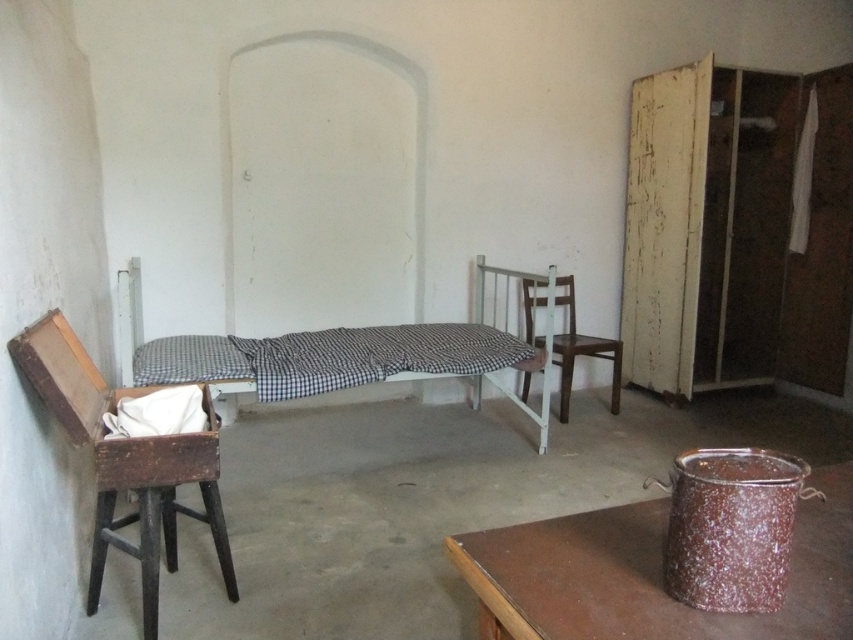
You are a guest staying in this room and want to place your new pillow, which is 15 cm taller than the existing one, on the bed. Can the checkered fabric bed at center support the height of your new pillow compared to the white cotton pillow at center?

The checkered fabric bed at center is taller than the white cotton pillow at center. Since your new pillow is 15 cm taller than the existing one, it should fit as the bed is already taller than the current pillow.

You are standing in the center of the room and want to move to the wooden chair at left. Which direction should you face to walk towards it?

You should face towards the left direction to walk towards the wooden chair at left.

You are a guest in this room and want to place a new decorative pillow on the bed. The existing white cotton pillow at center is already on the bed. Can you place the new pillow on top of the checkered fabric bed at center without moving the existing pillow?

The checkered fabric bed at center is located above the white cotton pillow at center, meaning the checkered fabric bed is actually the bed itself, and the white cotton pillow is placed on it. Therefore, you can place the new pillow on top of the checkered fabric bed at center along with the existing white cotton pillow at center.